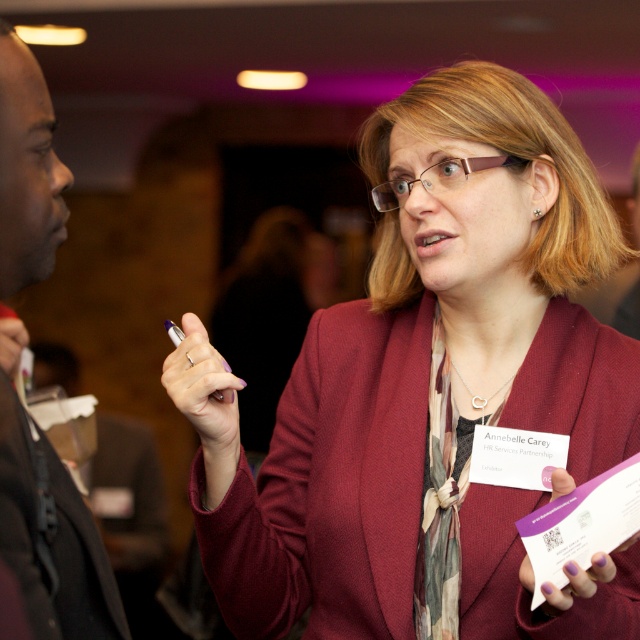
Question: Is maroon fabric coat at center to the right of purple matte pen at center from the viewer's perspective?

Choices:
 (A) yes
 (B) no

Answer: (A)

Question: Which of the following is the closest to the observer?

Choices:
 (A) (218, 419)
 (B) (506, 387)
 (C) (582, 595)
 (D) (58, 628)

Answer: (D)

Question: Does black fabric suit at left come behind purple matte card at center?

Choices:
 (A) yes
 (B) no

Answer: (B)

Question: Which point is closer to the camera taking this photo?

Choices:
 (A) (403, 552)
 (B) (237, 429)
 (C) (83, 572)

Answer: (C)

Question: Is maroon fabric coat at center further to the viewer compared to purple matte pen at center?

Choices:
 (A) no
 (B) yes

Answer: (A)

Question: Which of the following is the closest to the observer?

Choices:
 (A) (596, 577)
 (B) (486, 234)

Answer: (A)